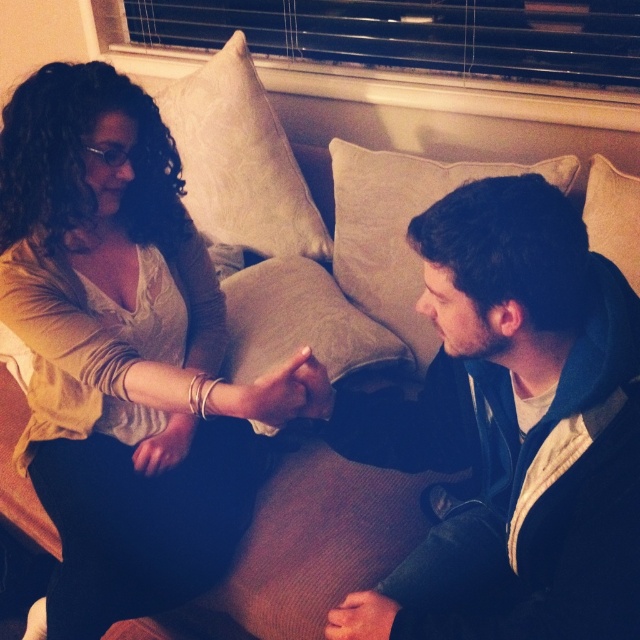
Question: Considering the relative positions of matte beige sweater at upper left and beige fabric pillow at upper right in the image provided, where is matte beige sweater at upper left located with respect to beige fabric pillow at upper right?

Choices:
 (A) right
 (B) left

Answer: (B)

Question: Which of these objects is positioned farthest from the dark blue hoodie at center?

Choices:
 (A) beige fabric pillow at upper right
 (B) matte beige sweater at upper left
 (C) beige fabric pillow at center

Answer: (C)

Question: Can you confirm if beige fabric pillow at center is smaller than beige fabric pillow at upper right?

Choices:
 (A) no
 (B) yes

Answer: (A)

Question: Which object appears closest to the camera in this image?

Choices:
 (A) matte beige sweater at upper left
 (B) dark blue hoodie at center

Answer: (B)

Question: Is matte beige sweater at upper left to the left of linen pillow at upper center from the viewer's perspective?

Choices:
 (A) yes
 (B) no

Answer: (A)

Question: Which point is farther to the camera?

Choices:
 (A) (234, 99)
 (B) (214, 472)

Answer: (A)